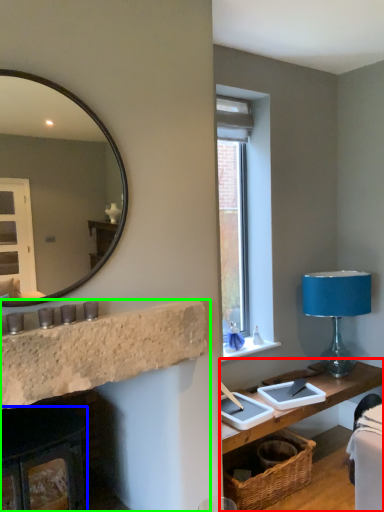
Question: Which object is the closest to the table (highlighted by a red box)? Choose among these: fireplace (highlighted by a blue box) or fireplace (highlighted by a green box).

Choices:
 (A) fireplace
 (B) fireplace

Answer: (B)